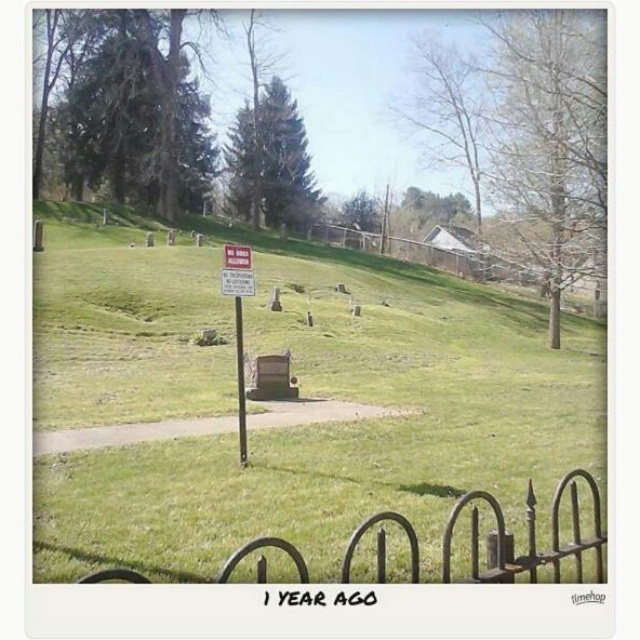
How distant is green grassy at center from white plastic sign at center?

A distance of 11.66 meters exists between green grassy at center and white plastic sign at center.

Between green grassy at center and white plastic sign at center, which one is positioned lower?

Positioned lower is white plastic sign at center.

Is point (294, 304) behind point (236, 385)?

Yes, point (294, 304) is behind point (236, 385).

I want to click on green grassy at center, so click(301, 413).

Which is below, iron fence at lower center or white plastic sign at center?

Positioned lower is iron fence at lower center.

Between point (385, 512) and point (244, 448), which one is positioned behind?

Positioned behind is point (244, 448).

The image size is (640, 640). In order to click on iron fence at lower center in this screenshot , I will do `click(525, 536)`.

Does green grassy at center appear on the right side of iron fence at lower center?

Incorrect, green grassy at center is not on the right side of iron fence at lower center.

Is point (504, 330) farther from viewer compared to point (577, 476)?

That is True.

Locate an element on the screen. The height and width of the screenshot is (640, 640). green grassy at center is located at coordinates (301, 413).